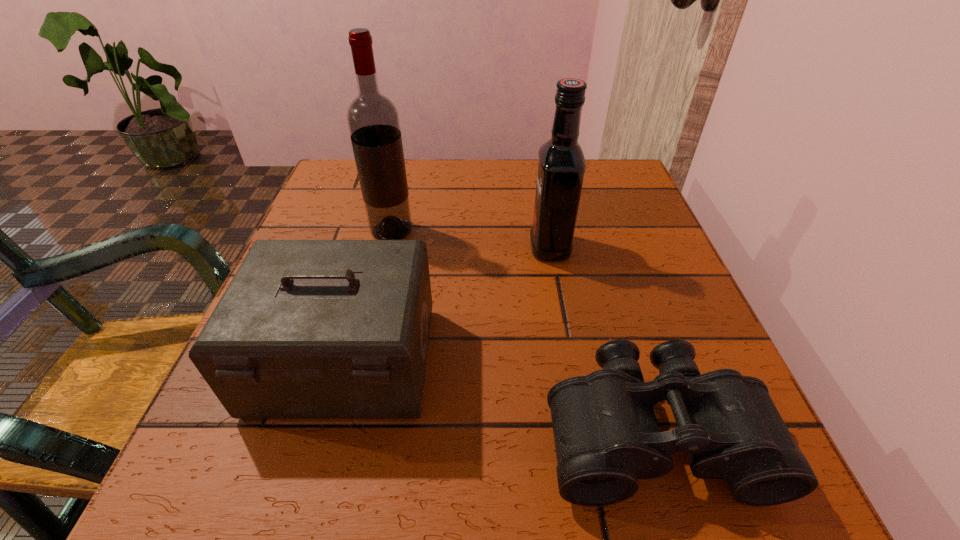
At what (x,y) coordinates should I click in order to perform the action: click on wine bottle. Please return your answer as a coordinate pair (x, y). The image size is (960, 540). Looking at the image, I should click on (373, 120).

Find the location of `the second tallest object`. the second tallest object is located at coordinates (562, 165).

Where is `the third tallest object`? The image size is (960, 540). the third tallest object is located at coordinates (307, 329).

Locate an element on the screen. Image resolution: width=960 pixels, height=540 pixels. the shortest object is located at coordinates (606, 434).

You are a GUI agent. You are given a task and a screenshot of the screen. Output one action in this format:
    pyautogui.click(x=<x>, y=<y>)
    Task: Click on the vacant area situated on the front of the tallest object
    This screenshot has height=540, width=960.
    Given the screenshot: What is the action you would take?
    pyautogui.click(x=385, y=260)

This screenshot has height=540, width=960. What are the coordinates of `vacant space located 0.150m on the front-facing side of the third shortest object` in the screenshot? It's located at (454, 247).

Where is `blank space located on the front-facing side of the third shortest object`? blank space located on the front-facing side of the third shortest object is located at coordinates (454, 247).

Locate an element on the screen. free spot located 0.050m on the front-facing side of the third shortest object is located at coordinates (505, 247).

At what (x,y) coordinates should I click in order to perform the action: click on blank space located 0.220m on the right of the first-aid kit. Please return your answer as a coordinate pair (x, y). Looking at the image, I should click on (573, 361).

Where is `object located in the near edge section of the desktop`? This screenshot has height=540, width=960. object located in the near edge section of the desktop is located at coordinates (606, 434).